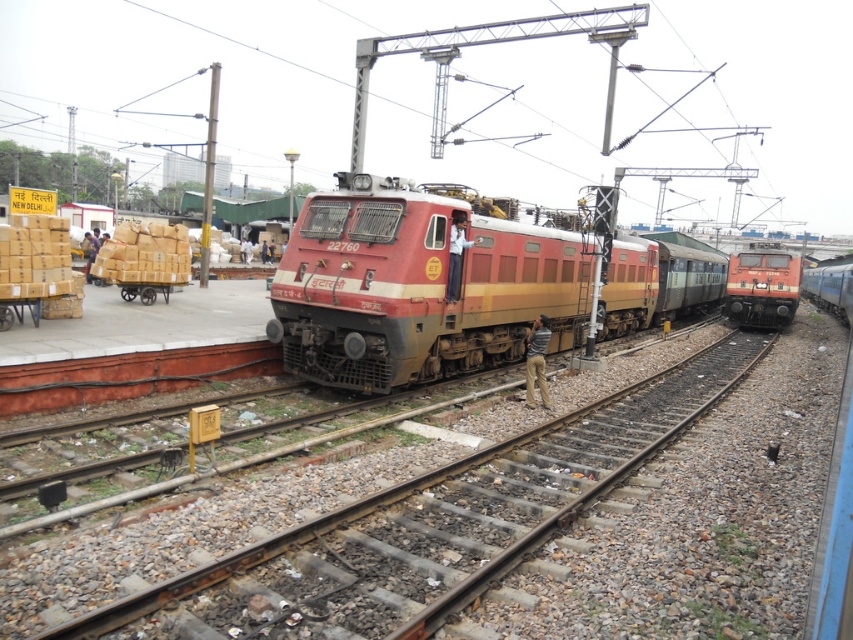
You are a railway inspector standing at the platform to the left of the matte red train at center. You need to walk to the locomotive to check its engine. Given that the platform is 10 meters long and the distance from your current position to the train is 6 meters, can you safely reach the train without crossing the red safety barrier?

Since the matte red train at center is located at point (418,284), which is within the platform area, and the distance from your position to the train is 6 meters, which is less than the platform length of 10 meters, you can safely reach the train without crossing the red safety barrier.

You are standing at the point marked as point (448,516). What is the surface you are currently standing on?

The point (448,516) is on rusty metal train track at center, so you are standing on a rusty metal train track.